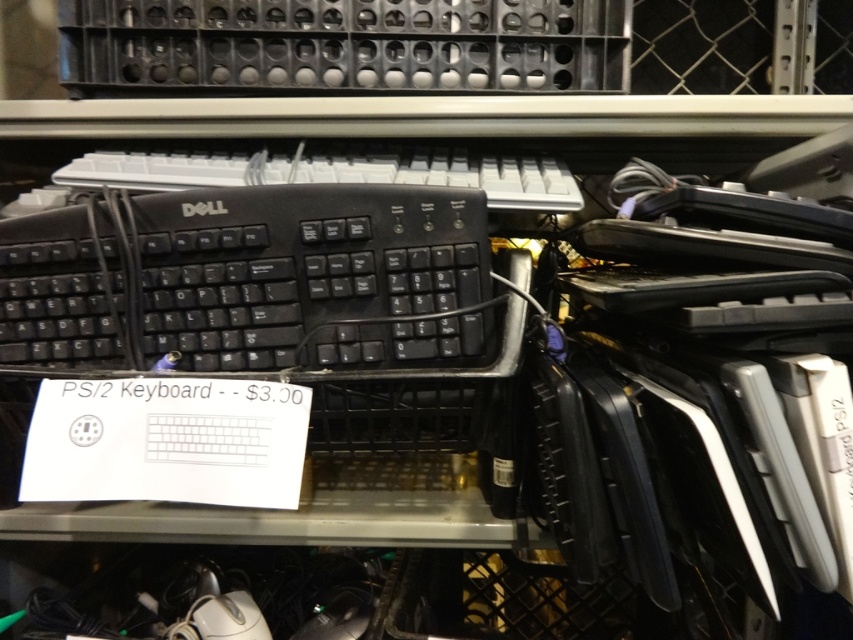
Question: Is white plastic keyboard at upper center closer to camera compared to white matte mouse at lower center?

Choices:
 (A) no
 (B) yes

Answer: (B)

Question: Is black matte keyboard at center smaller than white matte mouse at lower center?

Choices:
 (A) no
 (B) yes

Answer: (A)

Question: Considering the real-world distances, which object is farthest from the white matte mouse at lower center?

Choices:
 (A) black matte keyboard at center
 (B) white plastic keyboard at upper center

Answer: (B)

Question: Can you confirm if black matte keyboard at center is positioned to the left of white plastic keyboard at upper center?

Choices:
 (A) no
 (B) yes

Answer: (B)

Question: Which point is closer to the camera?

Choices:
 (A) black matte keyboard at center
 (B) white plastic keyboard at upper center

Answer: (A)

Question: Which point is closer to the camera?

Choices:
 (A) white plastic keyboard at upper center
 (B) black matte keyboard at center
 (C) white matte mouse at lower center

Answer: (B)